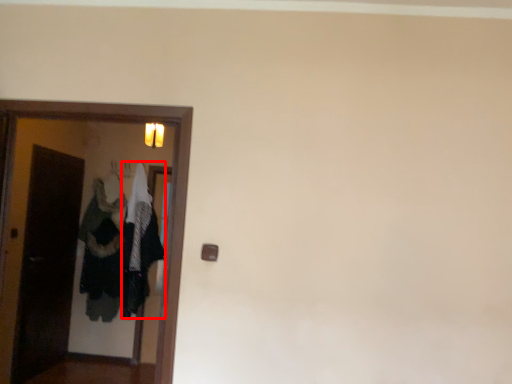
Question: From the image, what is the correct spatial relationship of clothing (annotated by the red box) in relation to door?

Choices:
 (A) right
 (B) left

Answer: (B)